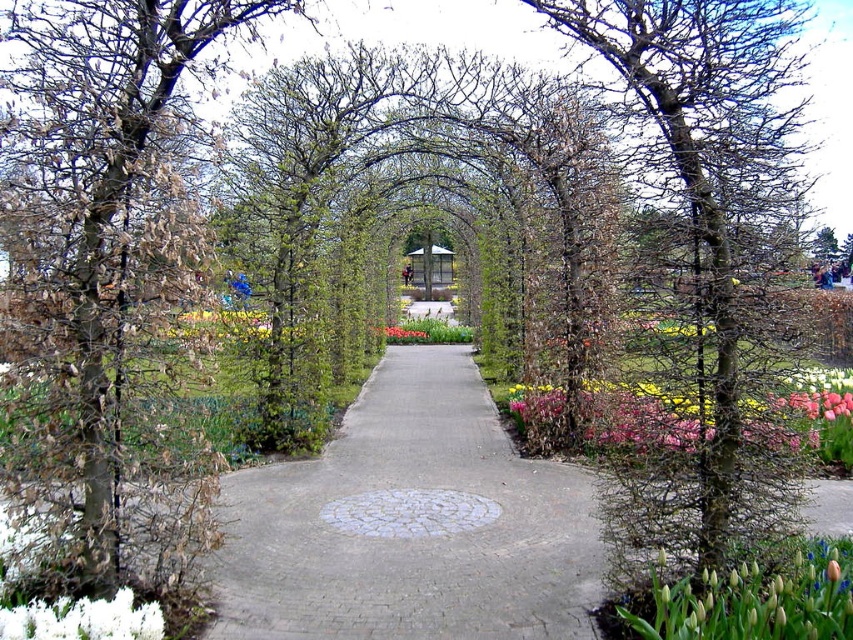
Question: Is white fluffy flower at lower left below pink matte flower at center?

Choices:
 (A) no
 (B) yes

Answer: (B)

Question: Is the position of green matte tulip at lower right more distant than that of white fluffy flower at lower left?

Choices:
 (A) yes
 (B) no

Answer: (B)

Question: Considering the real-world distances, which object is farthest from the brown textured trunk at center?

Choices:
 (A) pink matte flower at center
 (B) white fluffy flower at lower left
 (C) brown bark tree at left

Answer: (A)

Question: Does green matte tulip at lower right have a larger size compared to pink matte flower at center?

Choices:
 (A) yes
 (B) no

Answer: (A)

Question: Which point is farther to the camera?

Choices:
 (A) brown bark tree at left
 (B) brown textured trunk at center

Answer: (B)

Question: Which object appears closest to the camera in this image?

Choices:
 (A) pink matte flower at center
 (B) white fluffy flower at lower left
 (C) pink matte flowers at lower right

Answer: (B)